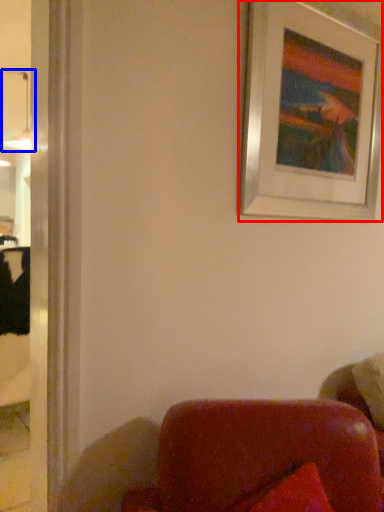
Question: Which of the following is the farthest to the observer, picture frame (highlighted by a red box) or lamp (highlighted by a blue box)?

Choices:
 (A) picture frame
 (B) lamp

Answer: (B)